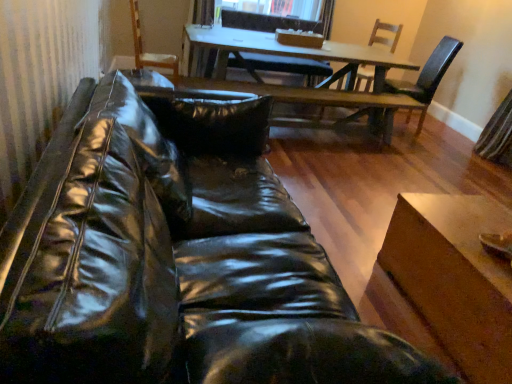
Question: Which direction should I rotate to face wooden chair at upper center, the 1th chair when ordered from left to right, — up or down?

Choices:
 (A) down
 (B) up

Answer: (B)

Question: From a real-world perspective, is glossy leather couch at lower left positioned under wooden table at center, the second table ordered from the bottom, based on gravity?

Choices:
 (A) no
 (B) yes

Answer: (A)

Question: Is glossy leather couch at lower left placed right next to wooden table at center, placed as the first table when sorted from back to front?

Choices:
 (A) no
 (B) yes

Answer: (A)

Question: Are glossy leather couch at lower left and wooden table at center, the first table when ordered from top to bottom, located far from each other?

Choices:
 (A) yes
 (B) no

Answer: (A)

Question: Considering the relative positions of glossy leather couch at lower left and wooden table at center, which ranks as the 2th table in front-to-back order, in the image provided, is glossy leather couch at lower left to the right of wooden table at center, which ranks as the 2th table in front-to-back order, from the viewer's perspective?

Choices:
 (A) no
 (B) yes

Answer: (A)

Question: Is glossy leather couch at lower left positioned in front of wooden table at center, placed as the first table when sorted from back to front?

Choices:
 (A) no
 (B) yes

Answer: (B)

Question: Does glossy leather couch at lower left have a smaller size compared to wooden table at center, placed as the first table when sorted from back to front?

Choices:
 (A) yes
 (B) no

Answer: (B)

Question: From a real-world perspective, is wooden table at lower right, which appears as the 1th table when viewed from the front, positioned under glossy leather couch at lower left based on gravity?

Choices:
 (A) yes
 (B) no

Answer: (A)

Question: Does wooden table at lower right, which appears as the 1th table when viewed from the front, have a larger size compared to glossy leather couch at lower left?

Choices:
 (A) no
 (B) yes

Answer: (A)

Question: Is wooden table at lower right, the first table ordered from the bottom, not within glossy leather couch at lower left?

Choices:
 (A) no
 (B) yes

Answer: (B)

Question: From the image's perspective, would you say wooden table at lower right, which appears as the 1th table when viewed from the front, is positioned over glossy leather couch at lower left?

Choices:
 (A) no
 (B) yes

Answer: (A)

Question: Is wooden table at lower right, the first table ordered from the bottom, positioned in front of glossy leather couch at lower left?

Choices:
 (A) no
 (B) yes

Answer: (A)

Question: Does wooden table at lower right, the first table ordered from the bottom, appear on the left side of glossy leather couch at lower left?

Choices:
 (A) no
 (B) yes

Answer: (A)

Question: Is wooden armchair at upper center thinner than glossy leather couch at lower left?

Choices:
 (A) yes
 (B) no

Answer: (A)